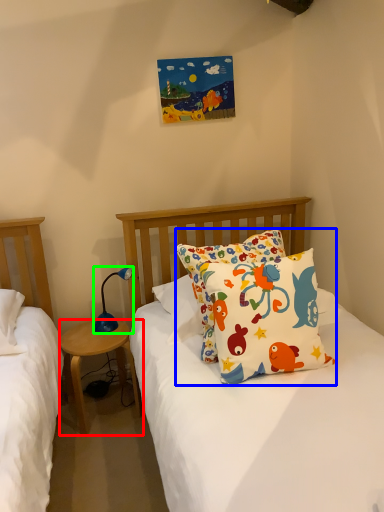
Question: Which object is the closest to the nightstand (highlighted by a red box)? Choose among these: pillow (highlighted by a blue box) or lamp (highlighted by a green box).

Choices:
 (A) pillow
 (B) lamp

Answer: (B)